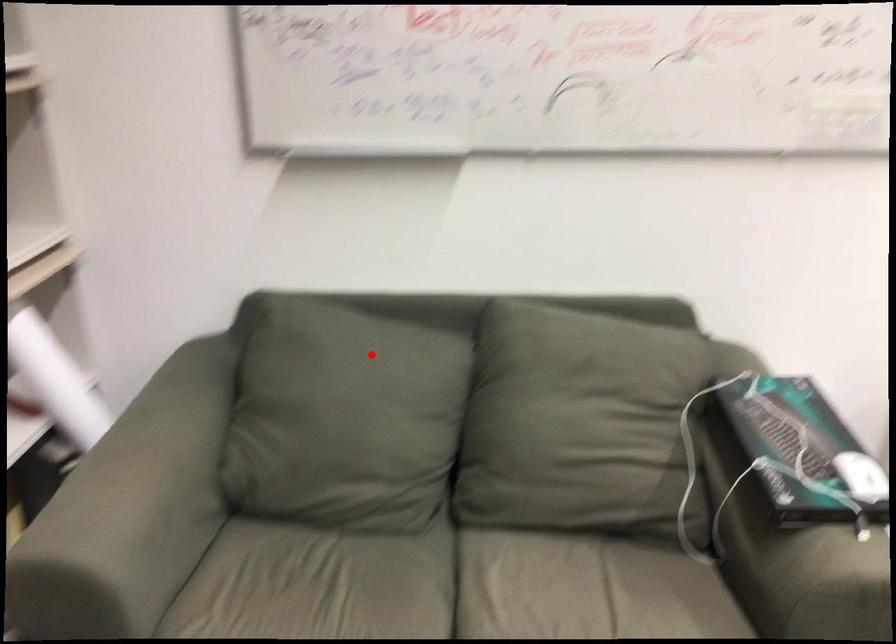
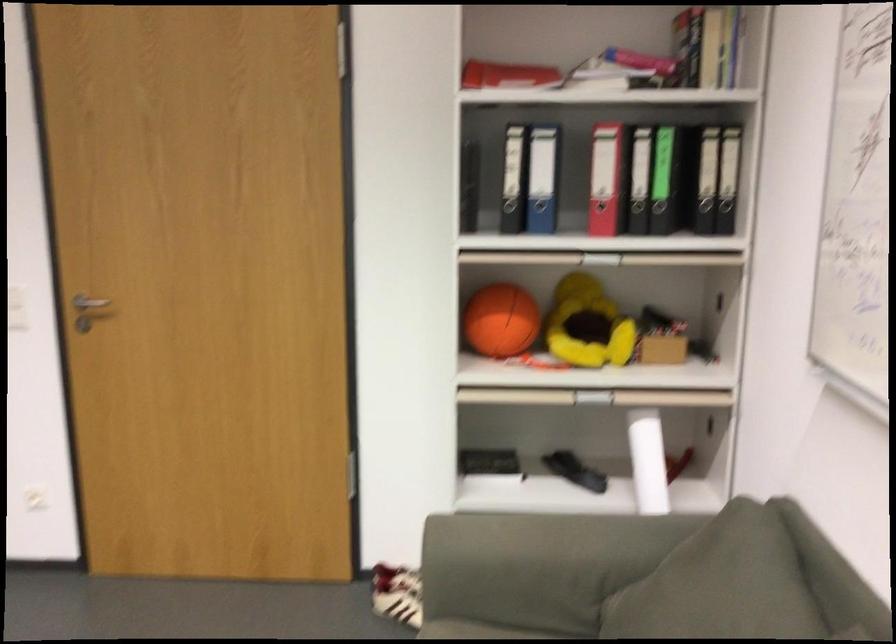
Find the pixel in the second image that matches the highlighted location in the first image.

(747, 592)